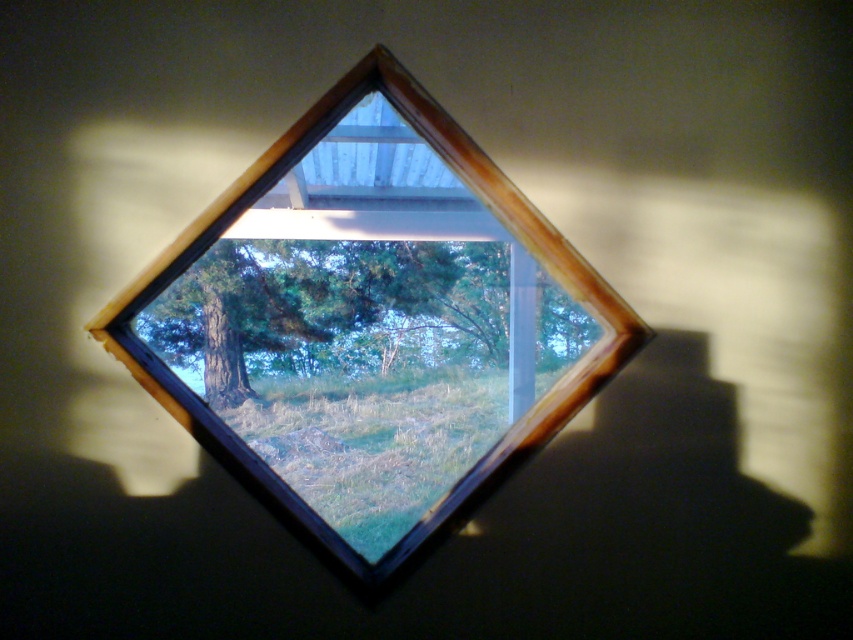
You are an interior designer assessing the lighting in a room with a wooden window frame at center and a green matte tree at center. Based on the scene, which object would cast a larger shadow on the floor?

The green matte tree at center would cast a larger shadow because it is larger than the wooden window frame at center.

You are an interior designer planning to place a large potted plant that is 3 meters tall in the room. The plant needs to be placed at least 3 meters away from the wooden window frame at center to avoid blocking the view. You want to place it near the green matte tree at center. Is this possible?

The wooden window frame at center is 2.96 meters from the green matte tree at center. Since the required distance is at least 3 meters, placing the plant near the green matte tree at center would not meet the requirement as the distance is slightly less than needed.

Based on the photo, you are an interior designer evaluating the placement of a new sofa in a room with the diamond shaped window. The point at coordinates (370, 324) marks the wooden window frame at center. If you want to place the sofa so it faces the window, where should you position it relative to the point?

The point at coordinates (370, 324) marks the wooden window frame at center. To face the window, the sofa should be placed directly in front of this point, ensuring it is centered and aligned with the window frame.